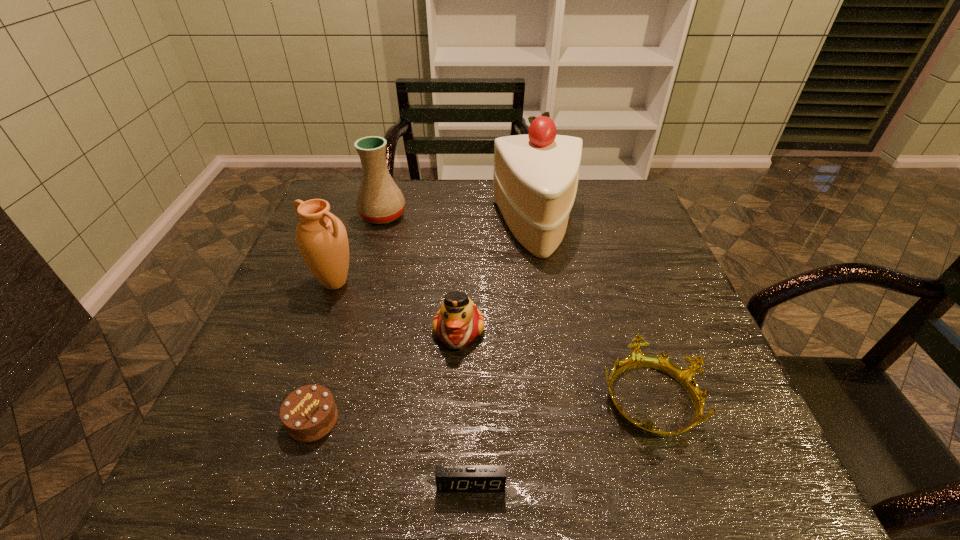
Find the location of `vacant space located on the right of the pottery`. vacant space located on the right of the pottery is located at coordinates (500, 215).

Locate an element on the screen. The height and width of the screenshot is (540, 960). vacant space located 0.050m on the right of the urn is located at coordinates (378, 282).

Find the location of `vacant area situated on the face of the duck`. vacant area situated on the face of the duck is located at coordinates (452, 478).

What are the coordinates of `free location located on the left of the crown` in the screenshot? It's located at (546, 398).

Locate an element on the screen. The height and width of the screenshot is (540, 960). vacant space located on the back of the chocolate cake is located at coordinates (350, 300).

Where is `cake that is at the far edge`? The height and width of the screenshot is (540, 960). cake that is at the far edge is located at coordinates (536, 175).

Where is `pottery present at the far edge`? The height and width of the screenshot is (540, 960). pottery present at the far edge is located at coordinates coord(379,200).

The width and height of the screenshot is (960, 540). Find the location of `crown that is at the near edge`. crown that is at the near edge is located at coordinates (685, 376).

Find the location of a particular element. The width and height of the screenshot is (960, 540). alarm clock at the near edge is located at coordinates (449, 478).

At what (x,y) coordinates should I click in order to perform the action: click on pottery at the left edge. Please return your answer as a coordinate pair (x, y). Looking at the image, I should click on (379, 200).